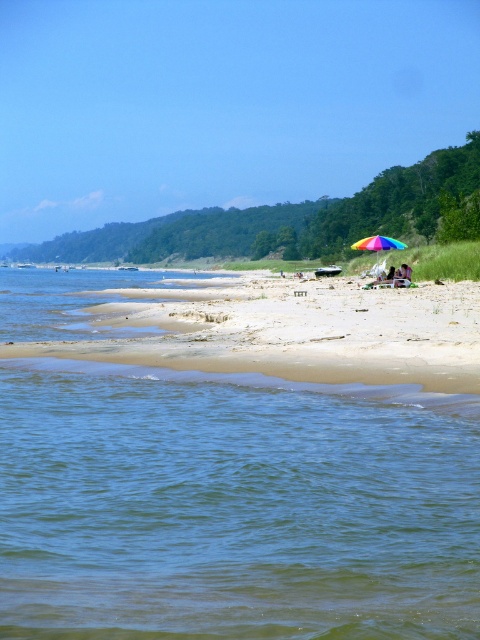
From the picture: You are standing on the beach and want to reach the clear blue water at lower left without getting your feet wet. The rainbow fabric umbrella at center is in your way. Can you walk around it to the left or right?

The clear blue water at lower left is below the rainbow fabric umbrella at center, so you can walk around it to the right side to reach the water without getting wet.